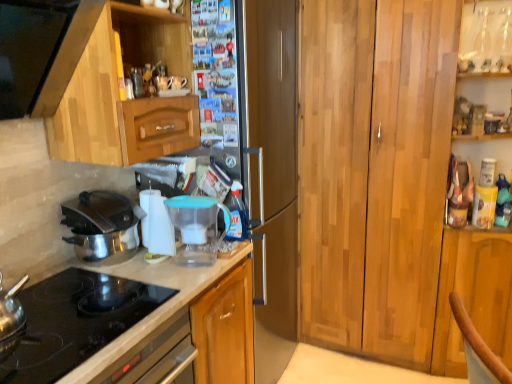
At what (x,y) coordinates should I click in order to perform the action: click on free spot in front of white plastic water filter at center, which is counted as the 2th appliance, starting from the right. Please return your answer as a coordinate pair (x, y). The width and height of the screenshot is (512, 384). Looking at the image, I should click on (161, 273).